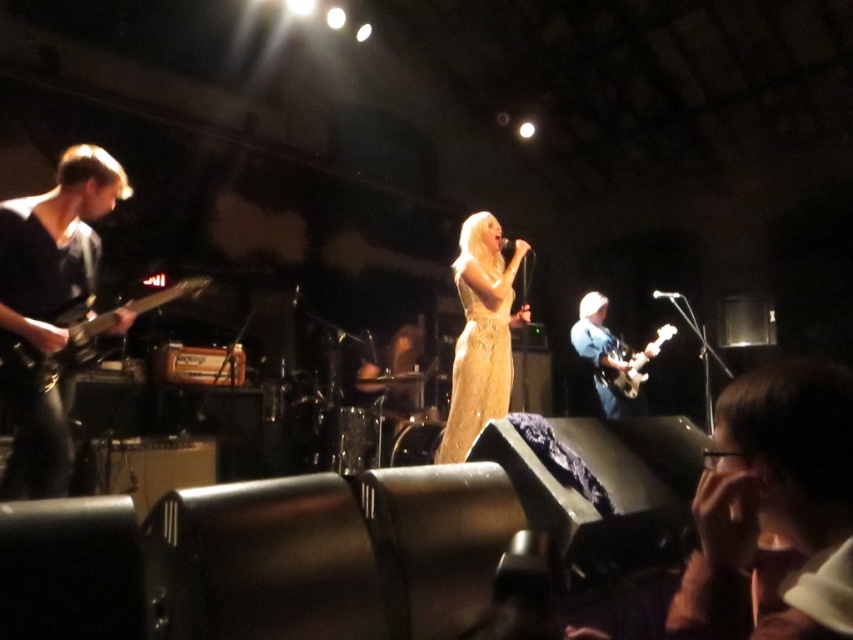
Describe the element at coordinates (480, 333) in the screenshot. I see `gold shimmering dress at center` at that location.

Where is `gold shimmering dress at center`? The image size is (853, 640). gold shimmering dress at center is located at coordinates (480, 333).

Find the location of a particular element. gold shimmering dress at center is located at coordinates (480, 333).

Consider the image. Is black matte guitar at left thinner than shiny silver electric guitar at center?

Indeed, black matte guitar at left has a lesser width compared to shiny silver electric guitar at center.

Who is positioned more to the left, black matte guitar at left or shiny silver electric guitar at center?

black matte guitar at left

The width and height of the screenshot is (853, 640). I want to click on black matte guitar at left, so click(54, 244).

In order to click on black matte guitar at left in this screenshot , I will do `click(54, 244)`.

Is gold shimmering dress at center smaller than shiny silver electric guitar at center?

Incorrect, gold shimmering dress at center is not smaller in size than shiny silver electric guitar at center.

Which of these two, gold shimmering dress at center or shiny silver electric guitar at center, stands taller?

With more height is gold shimmering dress at center.

This screenshot has height=640, width=853. Describe the element at coordinates (480, 333) in the screenshot. I see `gold shimmering dress at center` at that location.

Identify the location of gold shimmering dress at center. This screenshot has height=640, width=853. (480, 333).